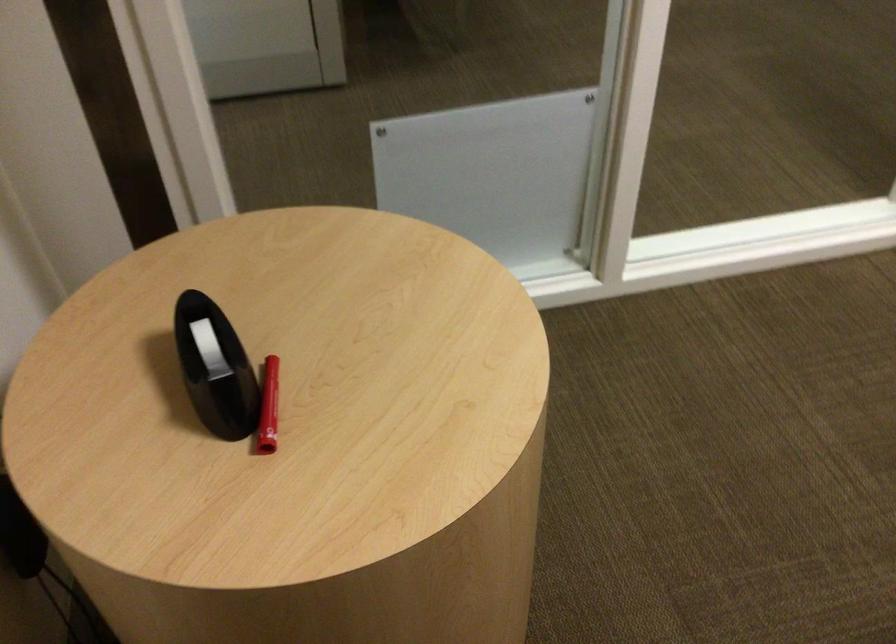
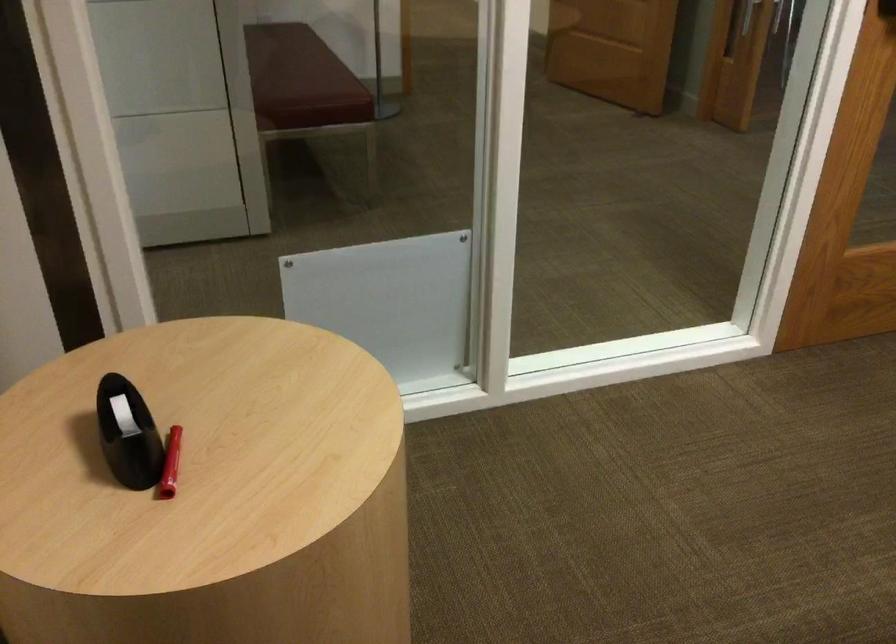
In the second image, find the point that corresponds to (218,375) in the first image.

(127, 433)